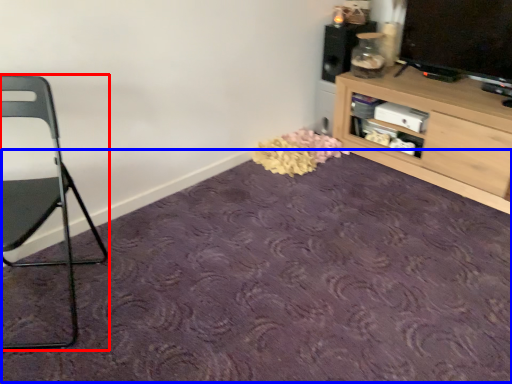
Question: Among these objects, which one is nearest to the camera, chair (highlighted by a red box) or plain (highlighted by a blue box)?

Choices:
 (A) chair
 (B) plain

Answer: (B)